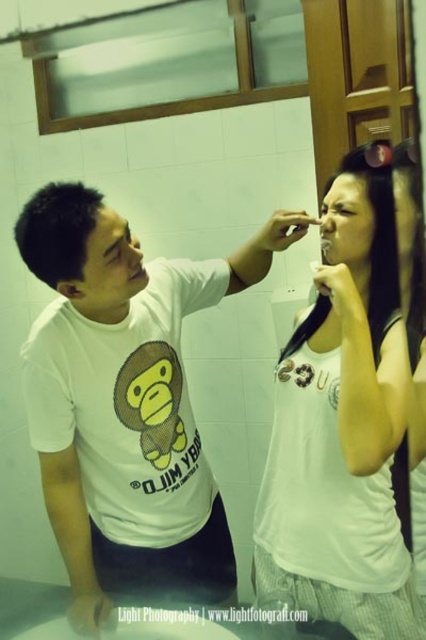
Question: Is white matte t-shirt at center above white cotton shirt at upper center?

Choices:
 (A) no
 (B) yes

Answer: (A)

Question: Does white matte t-shirt at center have a greater width compared to white cotton shirt at upper center?

Choices:
 (A) yes
 (B) no

Answer: (A)

Question: Which point appears closest to the camera in this image?

Choices:
 (A) (382, 492)
 (B) (192, 484)

Answer: (A)

Question: Is white matte t-shirt at center thinner than white cotton shirt at upper center?

Choices:
 (A) no
 (B) yes

Answer: (A)

Question: Which point appears closest to the camera in this image?

Choices:
 (A) (146, 545)
 (B) (141, 269)
 (C) (397, 422)

Answer: (C)

Question: Which point appears closest to the camera in this image?

Choices:
 (A) (131, 413)
 (B) (138, 280)

Answer: (B)